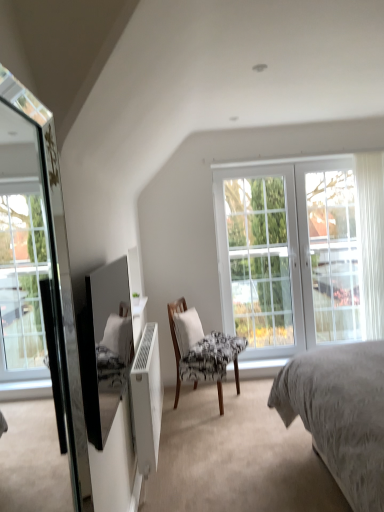
Looking at this image, in order to face white glass screen door at right, should I rotate leftwards or rightwards?

It's best to rotate right around 18.067 degrees.

Measure the distance between white sheer curtain at right and camera.

They are 4.11 meters apart.

What are the coordinates of `wooden chair with patterned fabric at center` in the screenshot? It's located at (201, 350).

Locate an element on the screen. The image size is (384, 512). white fabric pillow at center is located at coordinates (187, 330).

The width and height of the screenshot is (384, 512). In order to click on white matte radiator at lower left in this screenshot , I will do `click(147, 399)`.

Locate an element on the screen. Image resolution: width=384 pixels, height=512 pixels. white glass window at center, positioned as the second window in right-to-left order is located at coordinates (259, 259).

At what (x,y) coordinates should I click in order to perform the action: click on white glass screen door at right. Please return your answer as a coordinate pair (x, y). Looking at the image, I should click on (329, 253).

Is the depth of white sheer curtain at right less than that of black glossy mirror at left, positioned as the second mirror in front-to-back order?

No, it is behind black glossy mirror at left, positioned as the second mirror in front-to-back order.

Between white sheer curtain at right and black glossy mirror at left, positioned as the second mirror in front-to-back order, which one has larger size?

black glossy mirror at left, positioned as the second mirror in front-to-back order, is bigger.

Find the location of a particular element. The width and height of the screenshot is (384, 512). curtain behind the black glossy mirror at left, the 1th mirror positioned from the back is located at coordinates (x=370, y=239).

From a real-world perspective, is white sheer curtain at right physically located above or below black glossy mirror at left, positioned as the second mirror in front-to-back order?

Clearly, from a real-world perspective, white sheer curtain at right is above black glossy mirror at left, positioned as the second mirror in front-to-back order.

Between white glass screen door at right and black glass mirror at left, the 2th mirror positioned from the back, which one appears on the left side from the viewer's perspective?

From the viewer's perspective, black glass mirror at left, the 2th mirror positioned from the back, appears more on the left side.

Consider the image. From the image's perspective, which one is positioned higher, white glass screen door at right or black glass mirror at left, which appears as the 1th mirror when viewed from the front?

white glass screen door at right appears higher in the image.

Would you say white glass screen door at right is a long distance from black glass mirror at left, which appears as the 1th mirror when viewed from the front?

white glass screen door at right is far away from black glass mirror at left, which appears as the 1th mirror when viewed from the front.

Identify the location of screen door below the black glossy mirror at left, positioned as the second mirror in front-to-back order (from a real-world perspective). This screenshot has width=384, height=512. (329, 253).

From a real-world perspective, between black glossy mirror at left, the 1th mirror positioned from the back, and white glass screen door at right, who is vertically lower?

white glass screen door at right.

Is black glossy mirror at left, positioned as the second mirror in front-to-back order, wider or thinner than white glass screen door at right?

In the image, black glossy mirror at left, positioned as the second mirror in front-to-back order, appears to be more narrow than white glass screen door at right.

Is black glossy mirror at left, the 1th mirror positioned from the back, in contact with white glass screen door at right?

No, black glossy mirror at left, the 1th mirror positioned from the back, is not making contact with white glass screen door at right.

Are white matte radiator at lower left and white glass screen door at right making contact?

white matte radiator at lower left and white glass screen door at right are clearly separated.

Image resolution: width=384 pixels, height=512 pixels. What are the coordinates of `screen door located above the white matte radiator at lower left (from a real-world perspective)` in the screenshot? It's located at (329, 253).

Is white matte radiator at lower left positioned with its back to white glass screen door at right?

No, white matte radiator at lower left's orientation is not away from white glass screen door at right.

Who is taller, white matte radiator at lower left or white glass screen door at right?

white glass screen door at right is taller.

From a real-world perspective, which is physically below, white fabric pillow at center or white glass window at center, the second window viewed from the left?

white fabric pillow at center, from a real-world perspective.

From the picture: Is white fabric pillow at center looking in the opposite direction of white glass window at center, the second window viewed from the left?

white fabric pillow at center does not have its back to white glass window at center, the second window viewed from the left.

Is white fabric pillow at center closer to the viewer compared to white glass window at center, the first window when ordered from right to left?

Yes, white fabric pillow at center is closer to the viewer.

From the image's perspective, is black glass mirror at left, the 2th mirror positioned from the back, positioned above or below wooden chair with patterned fabric at center?

Clearly, from the image's perspective, black glass mirror at left, the 2th mirror positioned from the back, is above wooden chair with patterned fabric at center.

Is black glass mirror at left, which appears as the 1th mirror when viewed from the front, in front of or behind wooden chair with patterned fabric at center in the image?

In the image, black glass mirror at left, which appears as the 1th mirror when viewed from the front, appears in front of wooden chair with patterned fabric at center.

From the picture: Is black glass mirror at left, the 2th mirror positioned from the back, not inside wooden chair with patterned fabric at center?

That's correct, black glass mirror at left, the 2th mirror positioned from the back, is outside of wooden chair with patterned fabric at center.

What's the angular difference between black glass mirror at left, the 2th mirror positioned from the back, and wooden chair with patterned fabric at center's facing directions?

The angle between the facing direction of black glass mirror at left, the 2th mirror positioned from the back, and the facing direction of wooden chair with patterned fabric at center is 25.7 degrees.

Which object is positioned more to the right, white glass screen door at right or wooden chair with patterned fabric at center?

white glass screen door at right is more to the right.

From the image's perspective, is white glass screen door at right on wooden chair with patterned fabric at center?

Indeed, from the image's perspective, white glass screen door at right is shown above wooden chair with patterned fabric at center.

Looking at this image, from a real-world perspective, which object stands above the other?

white glass screen door at right, from a real-world perspective.

Is point (313, 234) positioned before point (183, 361)?

No.

You are a GUI agent. You are given a task and a screenshot of the screen. Output one action in this format:
    pyautogui.click(x=<x>, y=<y>)
    Task: Click on the mirror located underneath the white sheer curtain at right (from a real-world perspective)
    The image size is (384, 512).
    Given the screenshot: What is the action you would take?
    pyautogui.click(x=99, y=343)

The image size is (384, 512). I want to click on screen door behind the black glass mirror at left, which appears as the 1th mirror when viewed from the front, so click(x=329, y=253).

When comparing their distances from white glass window at center, positioned as the second window in right-to-left order, does white glass screen door at right or black glossy mirror at left, positioned as the second mirror in front-to-back order, seem closer?

white glass screen door at right is closer to white glass window at center, positioned as the second window in right-to-left order.

When comparing their distances from white glass window at center, positioned as the second window in right-to-left order, does wooden chair with patterned fabric at center or white sheer curtain at right seem closer?

wooden chair with patterned fabric at center lies closer to white glass window at center, positioned as the second window in right-to-left order, than the other object.

Looking at the image, which one is located closer to white glass window at center, the first window when ordered from right to left, black glass mirror at left, the 2th mirror positioned from the back, or white sheer curtain at right?

Based on the image, white sheer curtain at right appears to be nearer to white glass window at center, the first window when ordered from right to left.

Looking at the image, which one is located further to black glass mirror at left, which appears as the 1th mirror when viewed from the front, white sheer curtain at right or black glossy mirror at left, the 1th mirror positioned from the back?

white sheer curtain at right lies further to black glass mirror at left, which appears as the 1th mirror when viewed from the front, than the other object.

Considering their positions, is white matte radiator at lower left positioned further to wooden chair with patterned fabric at center than black glass mirror at left, the 2th mirror positioned from the back?

black glass mirror at left, the 2th mirror positioned from the back, lies further to wooden chair with patterned fabric at center than the other object.

Which object lies nearer to the anchor point white fabric pillow at center, white glass window at center, the first window when ordered from right to left, or white glass screen door at right?

The object closer to white fabric pillow at center is white glass window at center, the first window when ordered from right to left.

Looking at the image, which one is located further to white sheer curtain at right, wooden chair with patterned fabric at center or white glass window at center, the second window viewed from the left?

Based on the image, wooden chair with patterned fabric at center appears to be further to white sheer curtain at right.

In the scene shown: Based on their spatial positions, is white matte radiator at lower left or wooden chair with patterned fabric at center closer to white glass screen door at right?

wooden chair with patterned fabric at center lies closer to white glass screen door at right than the other object.

Find the location of a particular element. This screenshot has width=384, height=512. chair between black glossy mirror at left, the 1th mirror positioned from the back, and white glass window at center, positioned as the second window in right-to-left order, along the z-axis is located at coordinates (201, 350).

Locate an element on the screen. This screenshot has height=512, width=384. chair positioned between white matte radiator at lower left and white fabric pillow at center from near to far is located at coordinates (201, 350).

Image resolution: width=384 pixels, height=512 pixels. In order to click on screen door between white matte radiator at lower left and white sheer curtain at right in this screenshot , I will do `click(329, 253)`.

Identify the location of mirror between black glass mirror at left, which appears as the 1th mirror when viewed from the front, and white glass window at center, positioned as the second window in right-to-left order, from front to back. (99, 343).